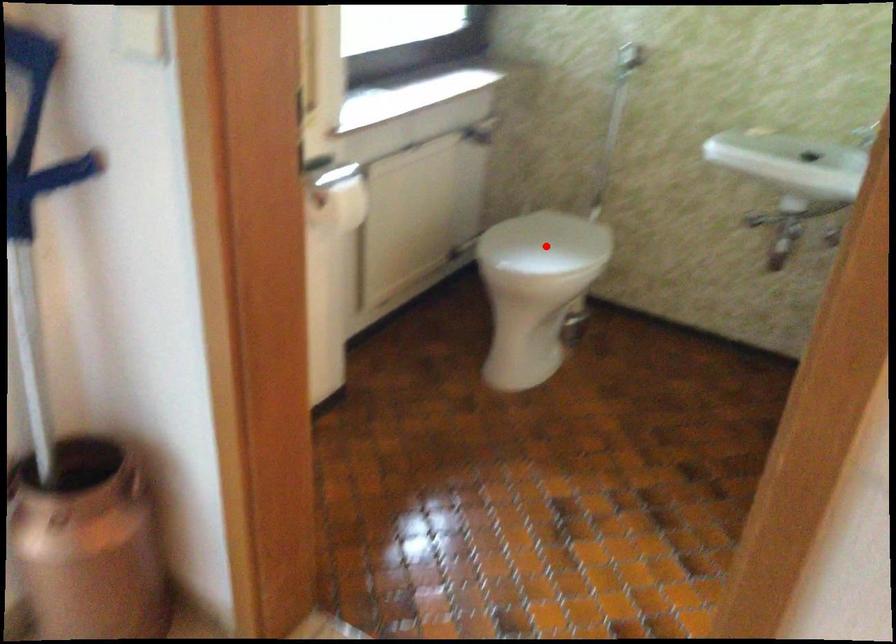
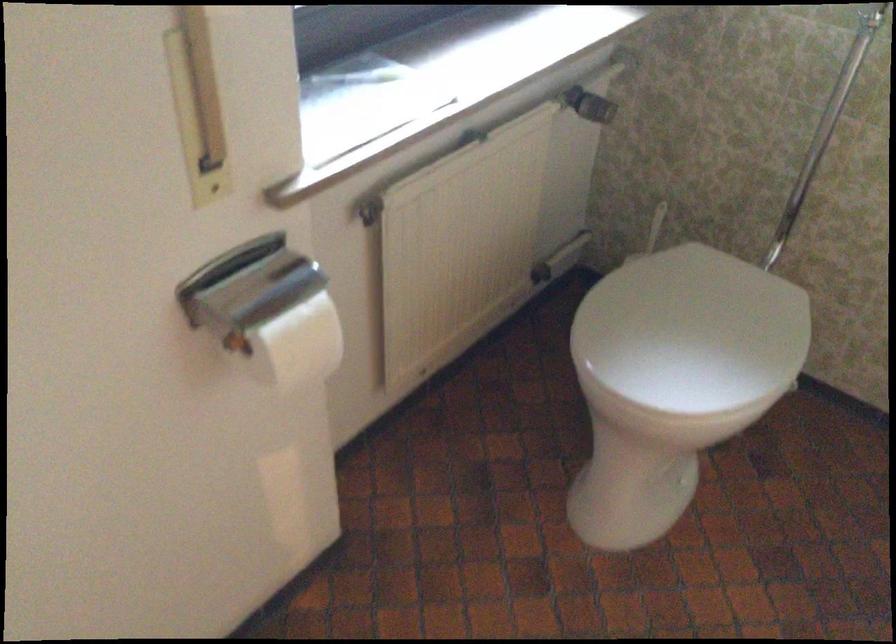
Where in the second image is the point corresponding to the highlighted location from the first image?

(692, 330)